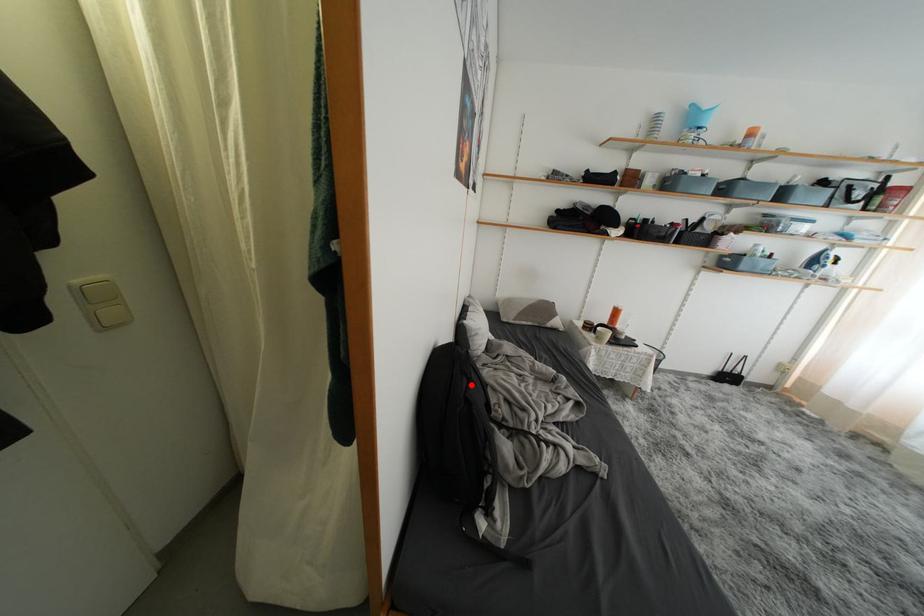
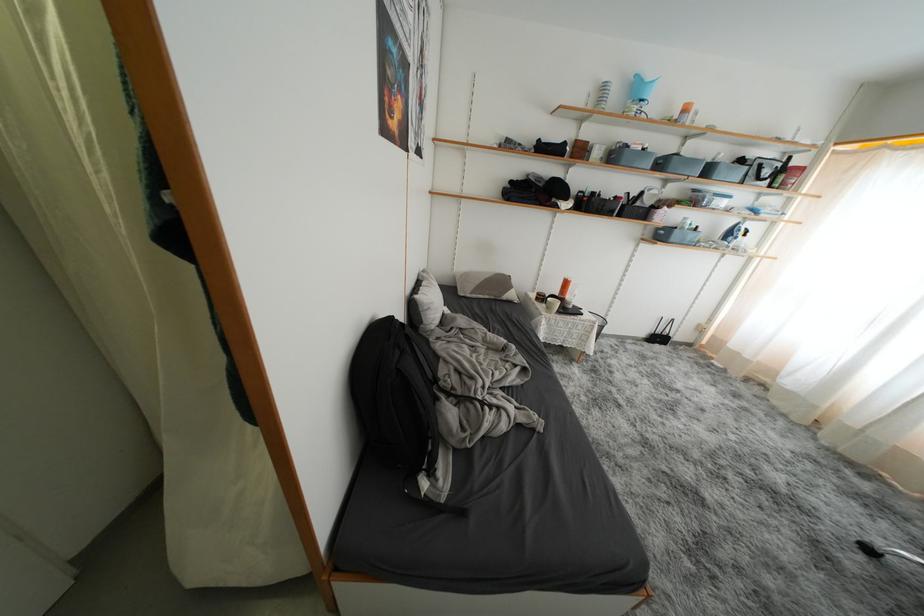
Question: I am providing you with two images of the same scene from different viewpoints. A red point is marked on the first image. Can you still see the location of the red point in image 2?

Choices:
 (A) Yes
 (B) No

Answer: (A)